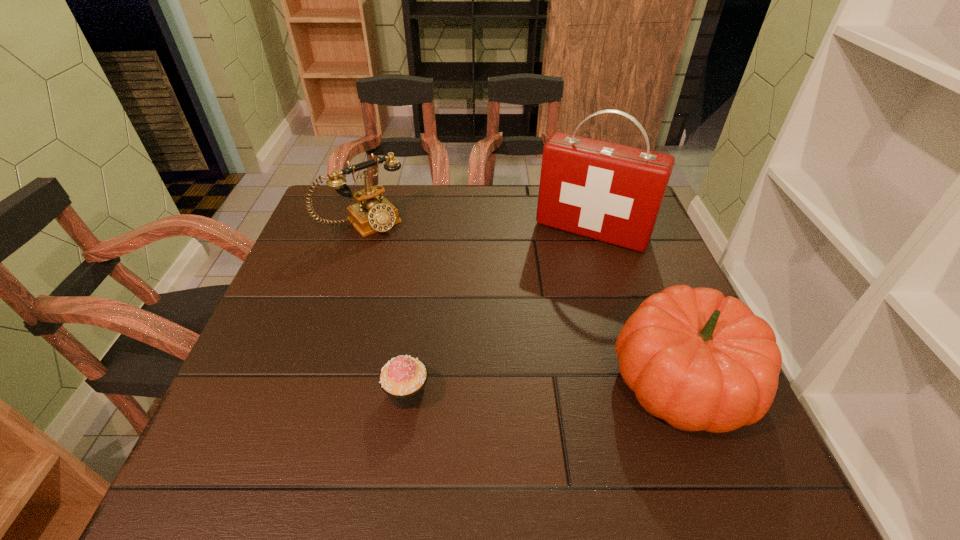
Identify the location of the second object from left to right. (403, 379).

Where is `the shortest object`? The height and width of the screenshot is (540, 960). the shortest object is located at coordinates (403, 379).

Where is `pumpkin`? pumpkin is located at coordinates (698, 360).

Where is `the leftmost object`? The width and height of the screenshot is (960, 540). the leftmost object is located at coordinates (372, 213).

I want to click on the tallest object, so click(x=609, y=192).

In order to click on vacant space located on the right of the second object from left to right in this screenshot , I will do `click(499, 394)`.

Where is `free space located 0.320m on the back of the pumpkin`? free space located 0.320m on the back of the pumpkin is located at coordinates tap(625, 235).

The width and height of the screenshot is (960, 540). I want to click on free space located 0.050m on the dial number of the telephone, so click(394, 247).

Identify the location of vacant space situated on the dial number of the telephone. (420, 276).

Find the location of a particular element. Image resolution: width=960 pixels, height=540 pixels. vacant space located on the dial number of the telephone is located at coordinates (427, 283).